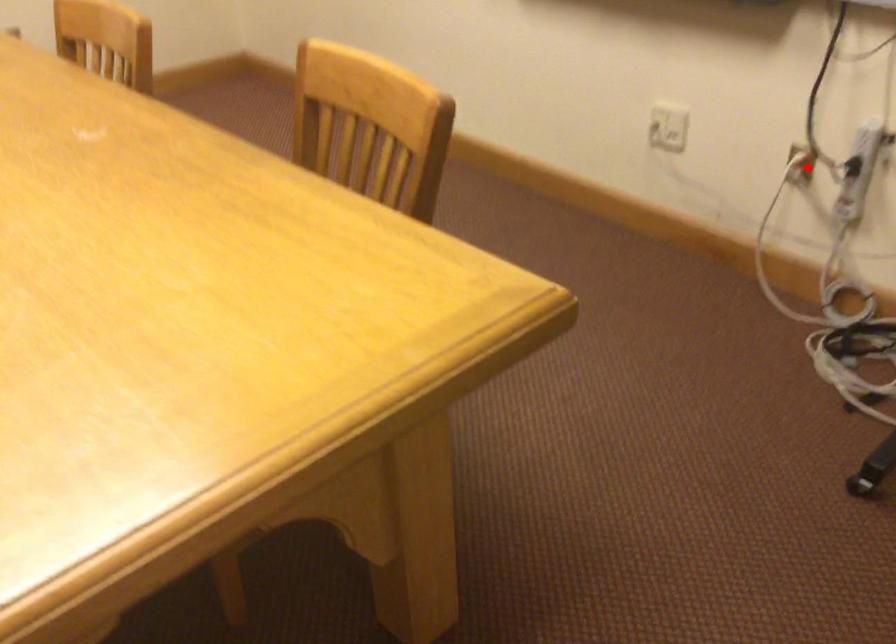
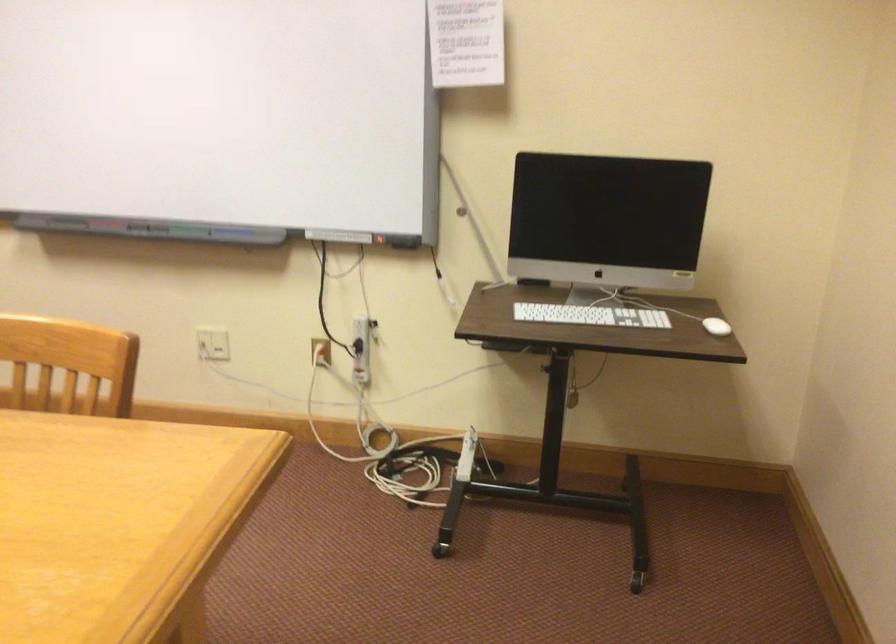
In the second image, find the point that corresponds to the highlighted location in the first image.

(321, 351)